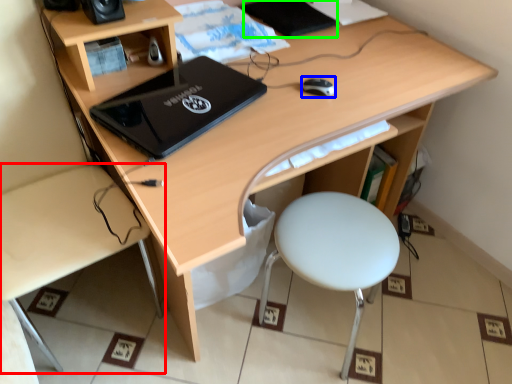
Question: Estimate the real-world distances between objects in this image. Which object is farther from desk (highlighted by a red box), mouse (highlighted by a blue box) or notebook (highlighted by a green box)?

Choices:
 (A) mouse
 (B) notebook

Answer: (B)